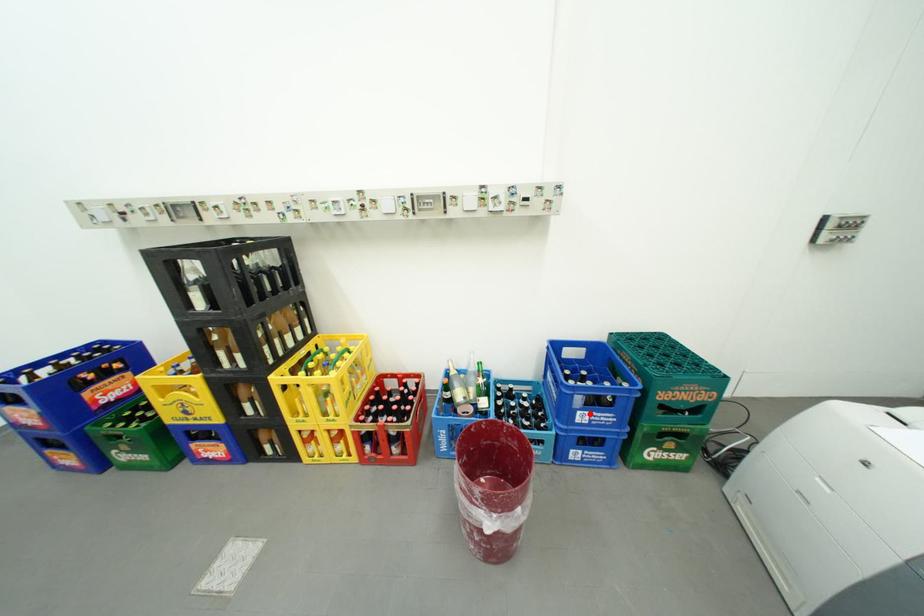
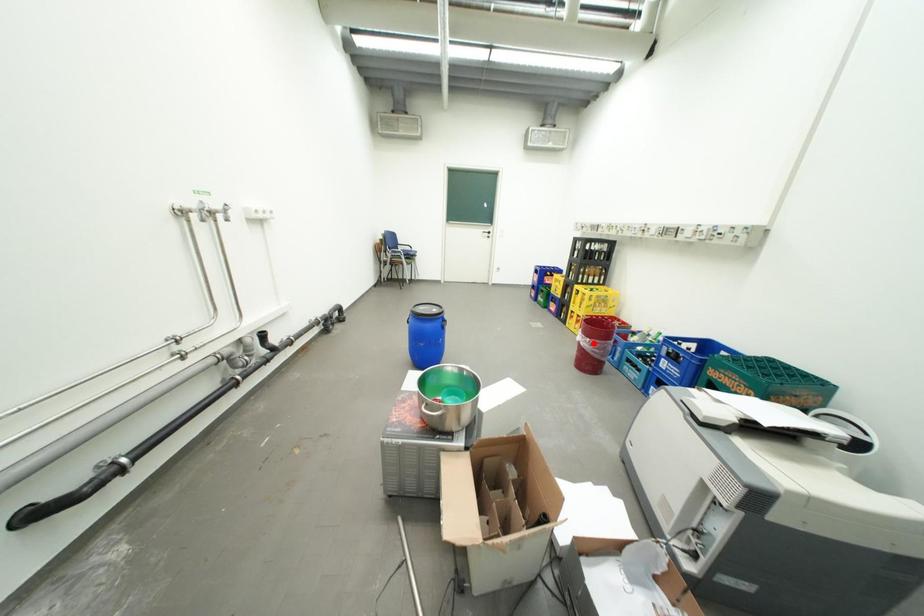
I am providing you with two images of the same scene from different viewpoints. A red point is marked on the first image and another point is marked on the second image. Is the red point in image1 aligned with the point shown in image2?

No